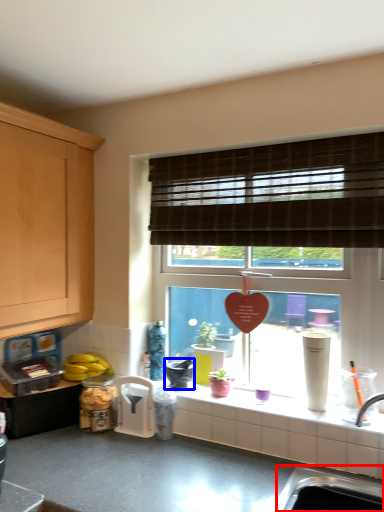
Question: Which object is closer to the camera taking this photo, sink (highlighted by a red box) or appliance (highlighted by a blue box)?

Choices:
 (A) sink
 (B) appliance

Answer: (A)